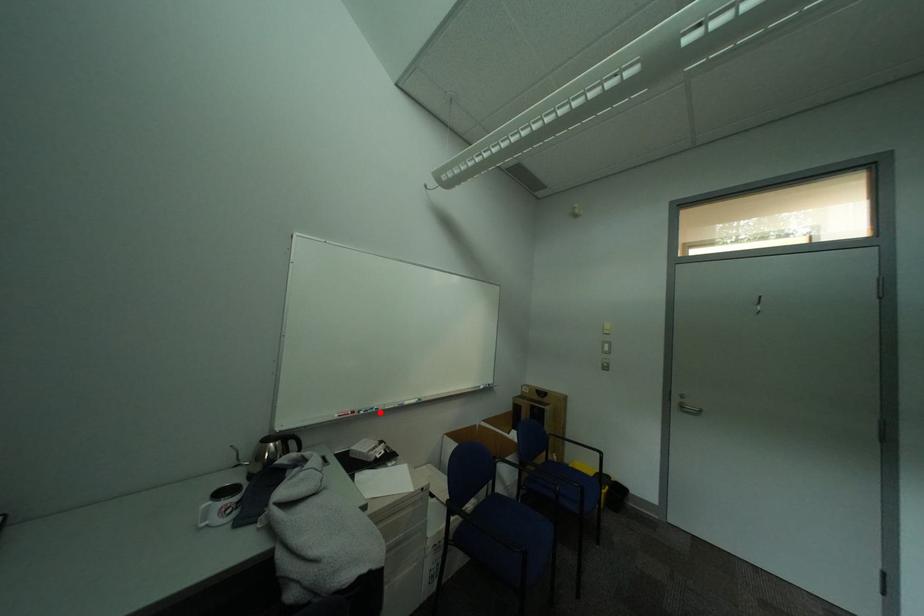
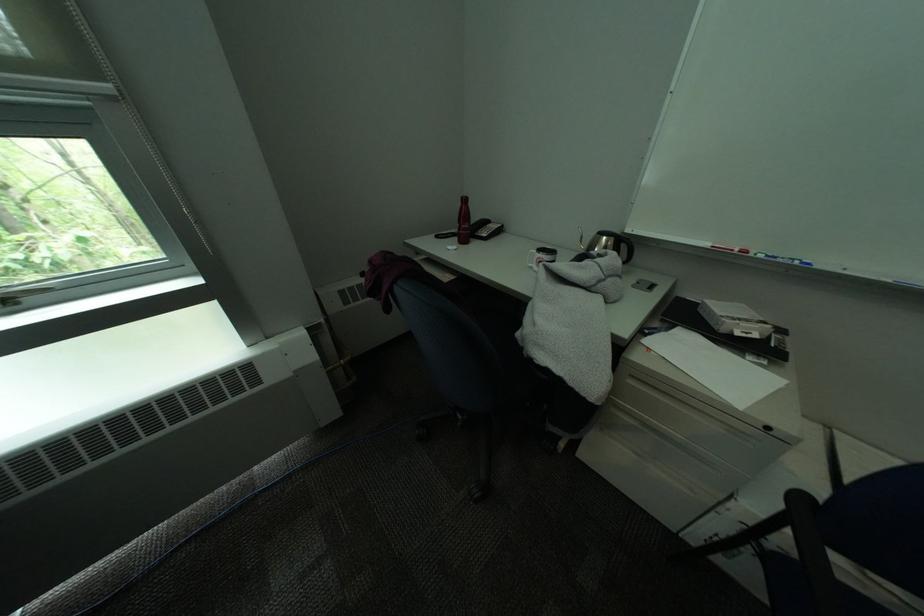
Locate, in the second image, the point that corresponds to the highlighted location in the first image.

(791, 262)